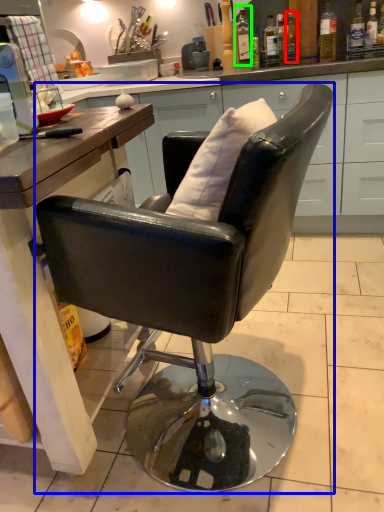
Question: Based on their relative distances, which object is farther from bottle (highlighted by a red box)? Choose from chair (highlighted by a blue box) and bottle (highlighted by a green box).

Choices:
 (A) chair
 (B) bottle

Answer: (A)